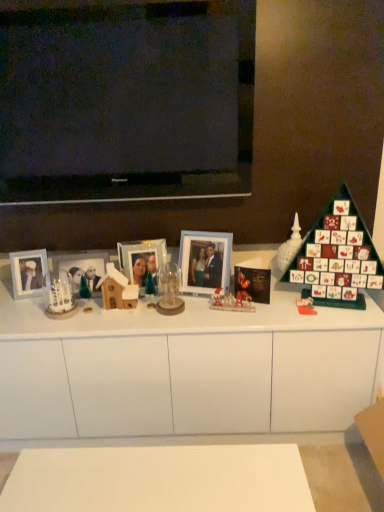
I want to click on vacant space in front of white glossy advent calendar at right, acting as the fourth toy starting from the left, so click(301, 302).